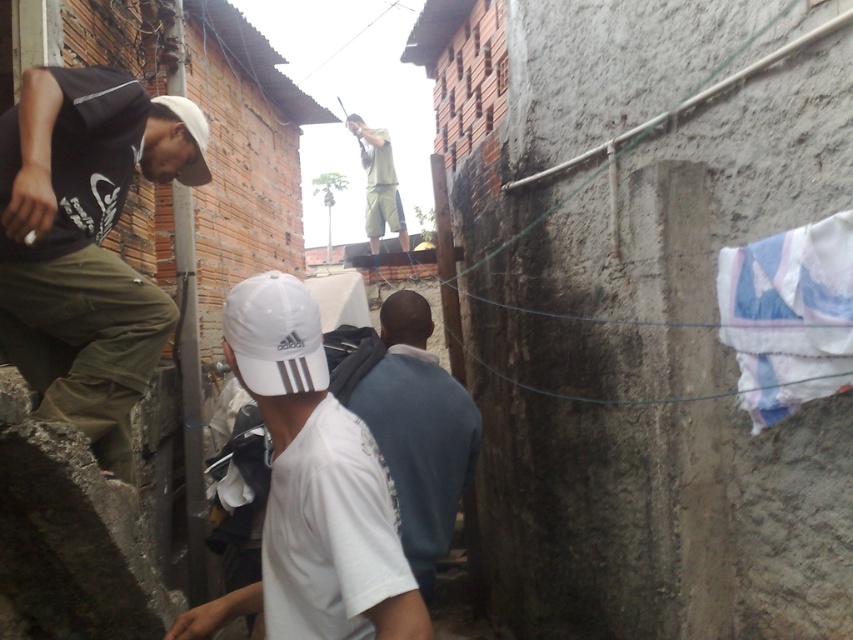
Question: Which is nearer to the white matte baseball cap at center?

Choices:
 (A) dark blue hoodie at center
 (B) matte black shirt at left
 (C) white matte cap at center
 (D) white matte baseball cap at upper left

Answer: (C)

Question: From the image, what is the correct spatial relationship of matte black shirt at left in relation to dark blue hoodie at center?

Choices:
 (A) below
 (B) above

Answer: (B)

Question: Which of the following is the closest to the observer?

Choices:
 (A) white matte cap at center
 (B) white matte baseball cap at upper left
 (C) dark blue hoodie at center
 (D) matte black shirt at left

Answer: (A)

Question: Is white matte baseball cap at center further to camera compared to white matte baseball cap at upper left?

Choices:
 (A) yes
 (B) no

Answer: (B)

Question: Which of the following is the farthest from the observer?

Choices:
 (A) (370, 252)
 (B) (346, 371)
 (C) (370, 493)

Answer: (A)

Question: Is matte black shirt at left to the right of white matte baseball cap at upper left from the viewer's perspective?

Choices:
 (A) no
 (B) yes

Answer: (A)